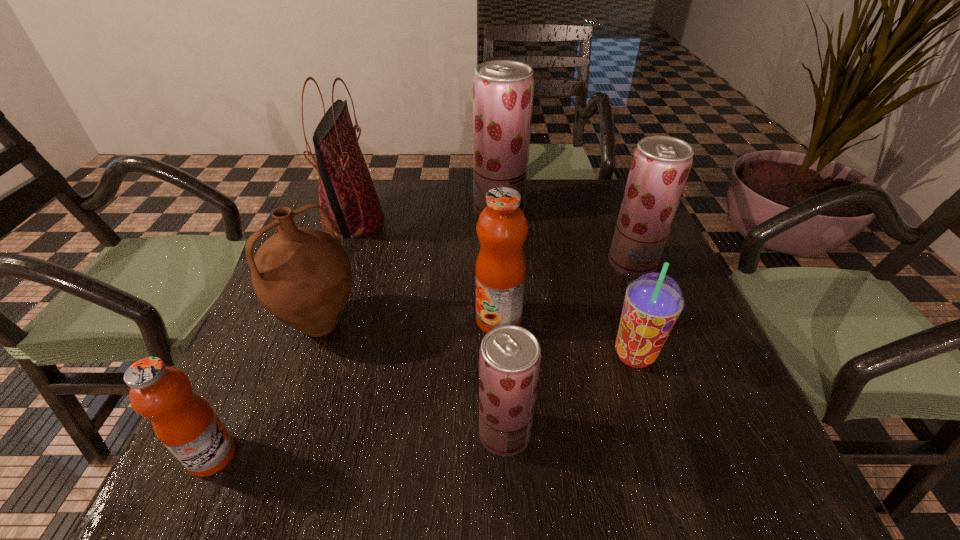
I want to click on free space between the farthest fruit juice and the handbag, so click(x=426, y=215).

This screenshot has width=960, height=540. In order to click on free point between the bigger orange fruit juice and the second smallest strawberry fruit juice in this screenshot , I will do `click(565, 292)`.

I want to click on vacant point located between the smallest strawberry fruit juice and the pitcher, so click(413, 379).

The image size is (960, 540). Identify the location of object that ranks as the second closest to the right orange fruit juice. (509, 356).

The width and height of the screenshot is (960, 540). Identify the location of object that ranks as the fourth closest to the rightmost fruit juice. click(x=509, y=356).

Select which fruit juice is the fourth closest to the tallest fruit juice. Please provide its 2D coordinates. Your answer should be formatted as a tuple, i.e. [(x, y)], where the tuple contains the x and y coordinates of a point satisfying the conditions above.

[(184, 422)]

The height and width of the screenshot is (540, 960). What are the coordinates of `fruit juice that stands as the third closest to the bigger orange fruit juice` in the screenshot? It's located at (503, 90).

Find the location of a particular element. The width and height of the screenshot is (960, 540). strawberry fruit juice object that ranks as the second closest to the left orange fruit juice is located at coordinates (503, 90).

Where is `the second closest strawberry fruit juice relative to the brown pitcher`? The height and width of the screenshot is (540, 960). the second closest strawberry fruit juice relative to the brown pitcher is located at coordinates (503, 90).

This screenshot has height=540, width=960. In order to click on blank area in the image that satisfies the following two spatial constraints: 1. on the front side of the farthest strawberry fruit juice; 2. on the left side of the smoothie in this screenshot , I will do `click(508, 355)`.